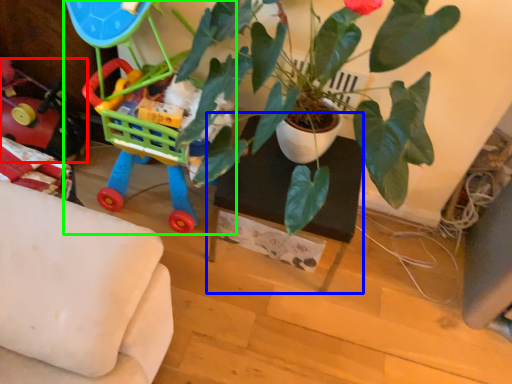
Question: Which is farther away from toy (highlighted by a red box)? table (highlighted by a blue box) or toy (highlighted by a green box)?

Choices:
 (A) table
 (B) toy

Answer: (A)